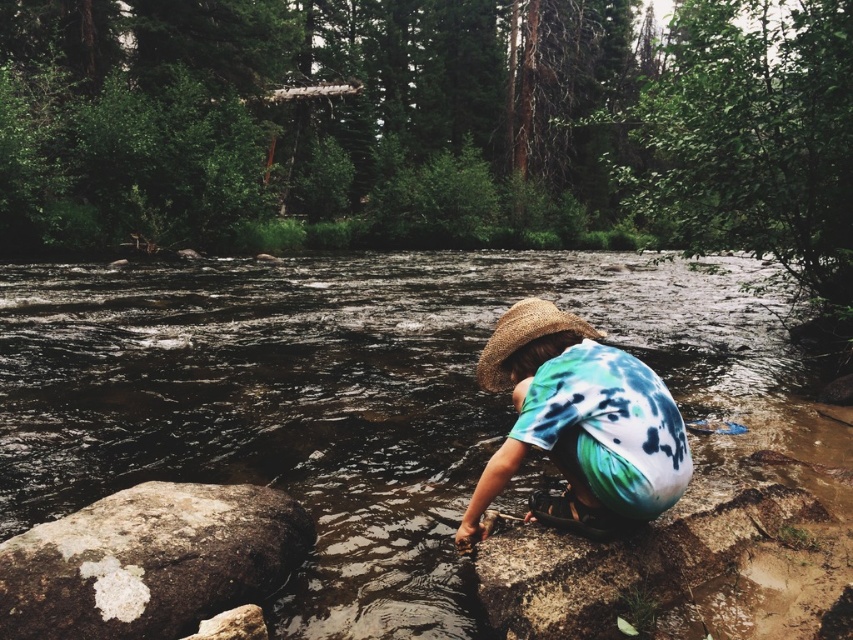
You are standing at the edge of the river and see two points marked in the image. Which point, point (x=619, y=392) or point (x=512, y=305), is closer to you?

Point (x=619, y=392) is closer to the viewer than point (x=512, y=305).